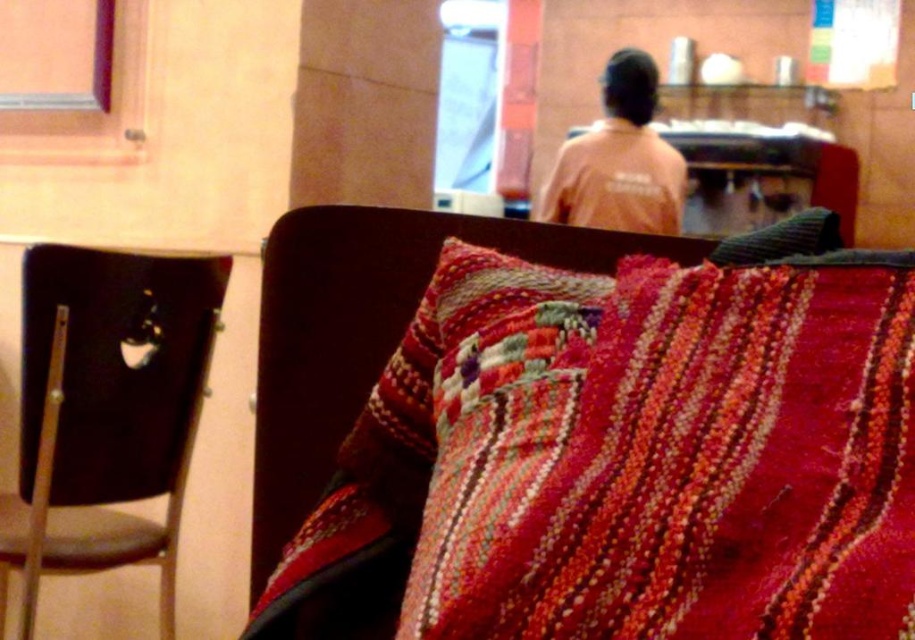
You are a delivery robot in a cafe. You need to deliver a small package to the point marked as point (833, 312). Your maximum delivery range is 20 inches. Can you reach that point?

The point (833, 312) is 19.38 inches away from the camera, so yes, the delivery robot can reach it since it is within the maximum delivery range of 20 inches.

You are a customer sitting at a table in the cafe and want to place your coffee cup on the nearest surface. The red cushion with intricate patterns and textures is on a dark wooden chair. Where should you place your cup to ensure it is closest to the knitted woolen blanket at center located at point (x=661, y=451)?

The knitted woolen blanket at center is located at point (x=661, y=451). Since the red cushion with intricate patterns and textures is on a dark wooden chair, placing the cup on the chair might bring it closer to the blanket. However, the nearest surface would likely be the table where you are sitting, which is not mentioned. Alternatively, if the blanket is on the table, placing the cup there would be closest. Without more details, the safest answer is the table near the blanket.